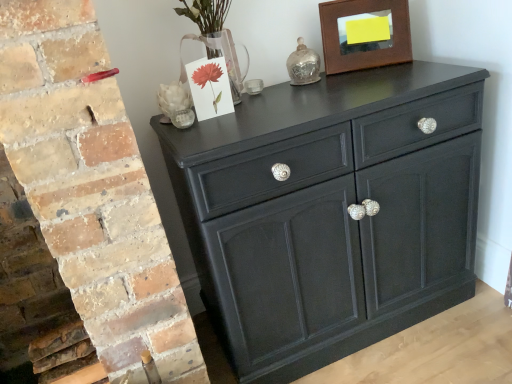
Question: From the image's perspective, does white matte sculpture at upper left appear higher than matte black cabinet at center?

Choices:
 (A) no
 (B) yes

Answer: (B)

Question: Is white matte sculpture at upper left not inside matte black cabinet at center?

Choices:
 (A) yes
 (B) no

Answer: (A)

Question: Is white matte sculpture at upper left to the left of matte black cabinet at center from the viewer's perspective?

Choices:
 (A) no
 (B) yes

Answer: (B)

Question: Considering the relative sizes of white matte sculpture at upper left and matte black cabinet at center in the image provided, is white matte sculpture at upper left wider than matte black cabinet at center?

Choices:
 (A) no
 (B) yes

Answer: (A)

Question: Can you confirm if white matte sculpture at upper left is bigger than matte black cabinet at center?

Choices:
 (A) yes
 (B) no

Answer: (B)

Question: Is white matte sculpture at upper left at the right side of matte black cabinet at center?

Choices:
 (A) no
 (B) yes

Answer: (A)

Question: From a real-world perspective, is matte black cabinet at center located higher than white matte sculpture at upper left?

Choices:
 (A) no
 (B) yes

Answer: (A)

Question: Is matte black cabinet at center behind white matte sculpture at upper left?

Choices:
 (A) no
 (B) yes

Answer: (A)

Question: Does matte black cabinet at center have a smaller size compared to white matte sculpture at upper left?

Choices:
 (A) yes
 (B) no

Answer: (B)

Question: Does matte black cabinet at center contain white matte sculpture at upper left?

Choices:
 (A) no
 (B) yes

Answer: (A)

Question: Would you say matte black cabinet at center is a long distance from white matte sculpture at upper left?

Choices:
 (A) no
 (B) yes

Answer: (A)

Question: Can you confirm if matte black cabinet at center is positioned to the left of white matte sculpture at upper left?

Choices:
 (A) yes
 (B) no

Answer: (B)

Question: Is the depth of brown wooden picture frame at upper right less than that of matte black cabinet at center?

Choices:
 (A) yes
 (B) no

Answer: (B)